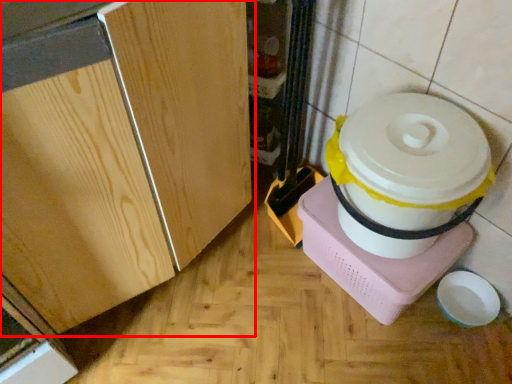
Question: From the image's perspective, what is the correct spatial positioning of cabinetry (annotated by the red box) in reference to appliance?

Choices:
 (A) below
 (B) above

Answer: (B)